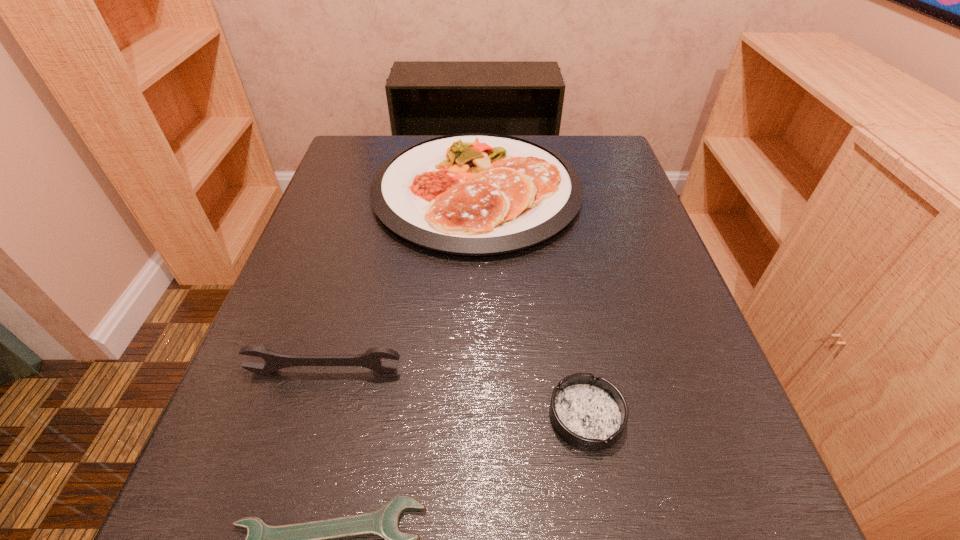
The height and width of the screenshot is (540, 960). In order to click on free space at the far right corner of the desktop in this screenshot , I will do `click(591, 164)`.

The height and width of the screenshot is (540, 960). In the image, there is a desktop. Find the location of `free region at the near right corner`. free region at the near right corner is located at coordinates (749, 507).

Locate an element on the screen. Image resolution: width=960 pixels, height=540 pixels. empty space between the ashtray and the farthest object is located at coordinates (531, 303).

The image size is (960, 540). I want to click on empty space that is in between the ashtray and the farthest object, so click(x=531, y=303).

Where is `vacant area that lies between the farthest object and the second farthest object`? The height and width of the screenshot is (540, 960). vacant area that lies between the farthest object and the second farthest object is located at coordinates (400, 281).

At what (x,y) coordinates should I click in order to perform the action: click on free space that is in between the farther wrench and the dish. Please return your answer as a coordinate pair (x, y). Looking at the image, I should click on (400, 281).

At what (x,y) coordinates should I click in order to perform the action: click on vacant space in between the third tallest object and the third nearest object. Please return your answer as a coordinate pair (x, y). The image size is (960, 540). Looking at the image, I should click on (455, 394).

Where is `object that is the third closest one to the farther wrench`? object that is the third closest one to the farther wrench is located at coordinates (475, 194).

The width and height of the screenshot is (960, 540). Identify the location of object that stands as the third closest to the dish. (318, 539).

Image resolution: width=960 pixels, height=540 pixels. What are the coordinates of `vacant space that satisfies the following two spatial constraints: 1. on the open ends of the ashtray; 2. on the left side of the taller wrench` in the screenshot? It's located at (311, 416).